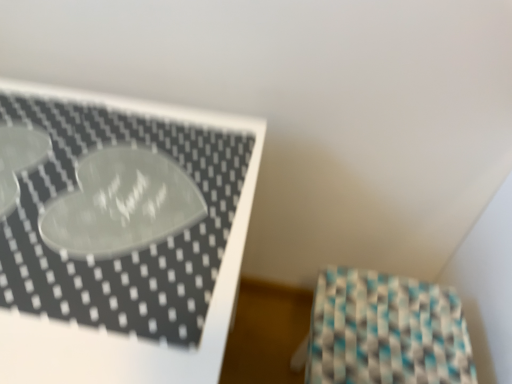
Question: From the image's perspective, is white glossy tray at upper left under teal-patterned fabric at lower right?

Choices:
 (A) no
 (B) yes

Answer: (A)

Question: Considering the relative sizes of white glossy tray at upper left and teal-patterned fabric at lower right in the image provided, is white glossy tray at upper left bigger than teal-patterned fabric at lower right?

Choices:
 (A) yes
 (B) no

Answer: (A)

Question: Considering the relative positions of white glossy tray at upper left and teal-patterned fabric at lower right in the image provided, is white glossy tray at upper left behind teal-patterned fabric at lower right?

Choices:
 (A) no
 (B) yes

Answer: (A)

Question: From a real-world perspective, is white glossy tray at upper left positioned under teal-patterned fabric at lower right based on gravity?

Choices:
 (A) yes
 (B) no

Answer: (B)

Question: Is white glossy tray at upper left looking in the opposite direction of teal-patterned fabric at lower right?

Choices:
 (A) no
 (B) yes

Answer: (A)

Question: Considering the relative positions of white glossy tray at upper left and teal-patterned fabric at lower right in the image provided, is white glossy tray at upper left to the left of teal-patterned fabric at lower right from the viewer's perspective?

Choices:
 (A) no
 (B) yes

Answer: (B)

Question: Considering the relative positions of teal-patterned fabric at lower right and white glossy tray at upper left in the image provided, is teal-patterned fabric at lower right to the left of white glossy tray at upper left from the viewer's perspective?

Choices:
 (A) no
 (B) yes

Answer: (A)

Question: Is teal-patterned fabric at lower right bigger than white glossy tray at upper left?

Choices:
 (A) yes
 (B) no

Answer: (B)

Question: Would you say teal-patterned fabric at lower right is outside white glossy tray at upper left?

Choices:
 (A) no
 (B) yes

Answer: (B)

Question: Considering the relative sizes of teal-patterned fabric at lower right and white glossy tray at upper left in the image provided, is teal-patterned fabric at lower right taller than white glossy tray at upper left?

Choices:
 (A) no
 (B) yes

Answer: (A)

Question: Does teal-patterned fabric at lower right lie behind white glossy tray at upper left?

Choices:
 (A) no
 (B) yes

Answer: (B)

Question: From the image's perspective, is teal-patterned fabric at lower right under white glossy tray at upper left?

Choices:
 (A) no
 (B) yes

Answer: (B)

Question: Is point (209, 241) positioned closer to the camera than point (353, 319)?

Choices:
 (A) closer
 (B) farther

Answer: (A)